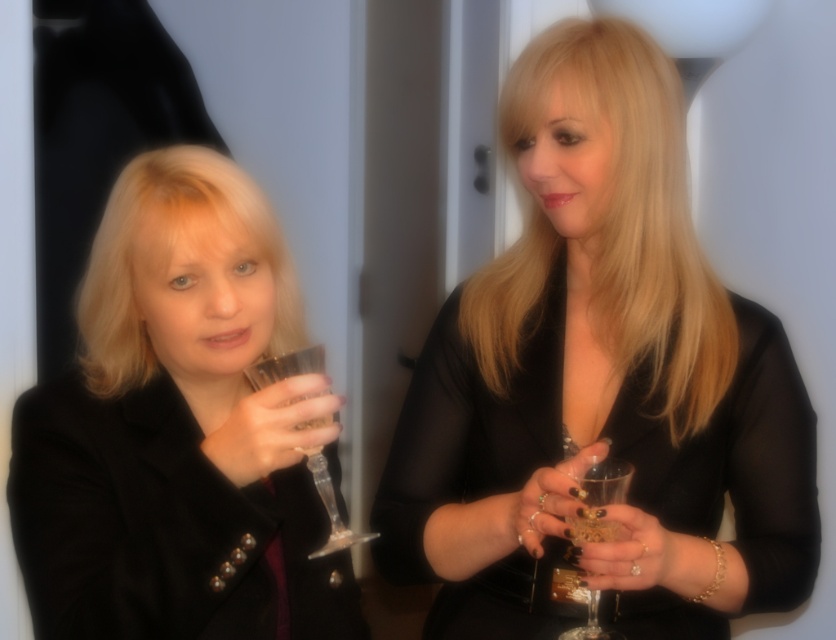
From the picture: Is black matte jacket at left smaller than clear glass wine glass at left?

Incorrect, black matte jacket at left is not smaller in size than clear glass wine glass at left.

Locate an element on the screen. The width and height of the screenshot is (836, 640). black matte jacket at left is located at coordinates (177, 429).

Who is more forward, (x=258, y=513) or (x=320, y=358)?

Point (x=258, y=513) is in front.

At what (x,y) coordinates should I click in order to perform the action: click on black matte jacket at left. Please return your answer as a coordinate pair (x, y). This screenshot has height=640, width=836. Looking at the image, I should click on (177, 429).

Does black glossy dress at center have a lesser width compared to clear glass wine glass at left?

In fact, black glossy dress at center might be wider than clear glass wine glass at left.

At what (x,y) coordinates should I click in order to perform the action: click on black glossy dress at center. Please return your answer as a coordinate pair (x, y). This screenshot has height=640, width=836. Looking at the image, I should click on (600, 385).

What are the coordinates of `black glossy dress at center` in the screenshot? It's located at (600, 385).

Is point (416, 547) in front of point (599, 634)?

No, (416, 547) is behind (599, 634).

Does black glossy dress at center appear on the right side of clear glass wine glass at center?

Correct, you'll find black glossy dress at center to the right of clear glass wine glass at center.

Image resolution: width=836 pixels, height=640 pixels. Describe the element at coordinates (600, 385) in the screenshot. I see `black glossy dress at center` at that location.

Where is `black glossy dress at center`? The height and width of the screenshot is (640, 836). black glossy dress at center is located at coordinates (600, 385).